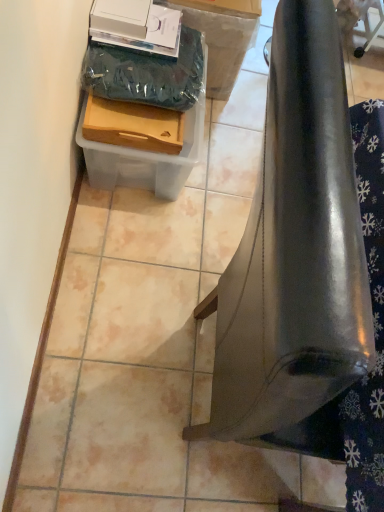
Question: Could you tell me if glossy metallic bell at lower right is facing wooden tray at lower left, the 2th box viewed from the back?

Choices:
 (A) yes
 (B) no

Answer: (B)

Question: Is glossy metallic bell at lower right taller than wooden tray at lower left, the first box in the front-to-back sequence?

Choices:
 (A) no
 (B) yes

Answer: (B)

Question: Can you confirm if glossy metallic bell at lower right is positioned to the right of wooden tray at lower left, the first box in the front-to-back sequence?

Choices:
 (A) yes
 (B) no

Answer: (A)

Question: From the image's perspective, is glossy metallic bell at lower right located beneath wooden tray at lower left, the 2th box viewed from the back?

Choices:
 (A) no
 (B) yes

Answer: (B)

Question: Is glossy metallic bell at lower right turned away from wooden tray at lower left, the first box in the front-to-back sequence?

Choices:
 (A) yes
 (B) no

Answer: (B)

Question: From the image's perspective, is wooden tray at lower left, the first box in the front-to-back sequence, located above or below glossy metallic bell at lower right?

Choices:
 (A) above
 (B) below

Answer: (A)

Question: Which is correct: wooden tray at lower left, the first box in the front-to-back sequence, is inside glossy metallic bell at lower right, or outside of it?

Choices:
 (A) outside
 (B) inside

Answer: (A)

Question: Considering the positions of wooden tray at lower left, the 2th box viewed from the back, and glossy metallic bell at lower right in the image, is wooden tray at lower left, the 2th box viewed from the back, wider or thinner than glossy metallic bell at lower right?

Choices:
 (A) thin
 (B) wide

Answer: (A)

Question: Is wooden tray at lower left, the 2th box viewed from the back, taller or shorter than glossy metallic bell at lower right?

Choices:
 (A) tall
 (B) short

Answer: (B)

Question: Considering their positions, is clear plastic container at lower left, arranged as the first box when viewed from the back, located in front of or behind wooden tray at lower left, the first box in the front-to-back sequence?

Choices:
 (A) behind
 (B) front

Answer: (A)

Question: Considering the positions of clear plastic container at lower left, placed as the 2th box when sorted from front to back, and wooden tray at lower left, the 2th box viewed from the back, in the image, is clear plastic container at lower left, placed as the 2th box when sorted from front to back, bigger or smaller than wooden tray at lower left, the 2th box viewed from the back,?

Choices:
 (A) big
 (B) small

Answer: (A)

Question: Would you say clear plastic container at lower left, arranged as the first box when viewed from the back, is to the left or to the right of wooden tray at lower left, the first box in the front-to-back sequence, in the picture?

Choices:
 (A) left
 (B) right

Answer: (A)

Question: From the image's perspective, relative to wooden tray at lower left, the 2th box viewed from the back, is clear plastic container at lower left, placed as the 2th box when sorted from front to back, above or below?

Choices:
 (A) below
 (B) above

Answer: (A)

Question: In terms of height, does wooden tray at lower left, the 2th box viewed from the back, look taller or shorter compared to clear plastic container at lower left, arranged as the first box when viewed from the back?

Choices:
 (A) tall
 (B) short

Answer: (B)

Question: Considering their positions, is wooden tray at lower left, the first box in the front-to-back sequence, located in front of or behind clear plastic container at lower left, placed as the 2th box when sorted from front to back?

Choices:
 (A) front
 (B) behind

Answer: (A)